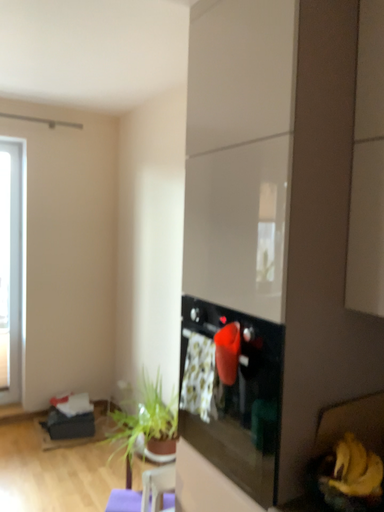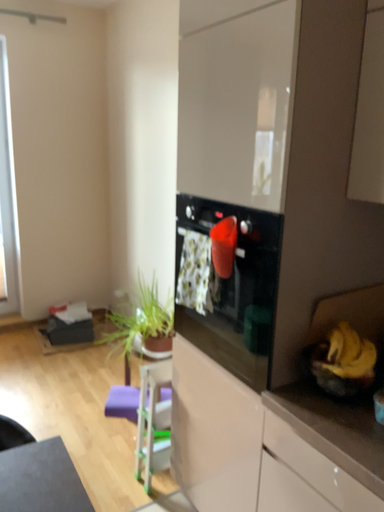
Question: How did the camera likely rotate when shooting the video?

Choices:
 (A) rotated upward
 (B) rotated downward

Answer: (B)